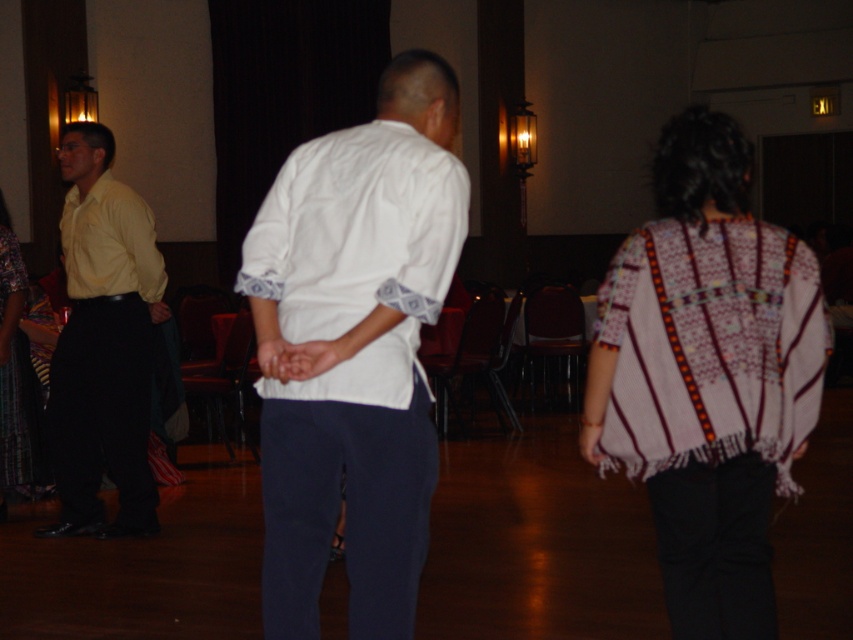
Question: Which object is the farthest from the white cotton dress shirt at center?

Choices:
 (A) patterned fabric poncho at center
 (B) white cotton shirt at center

Answer: (A)

Question: Is white cotton dress shirt at center closer to the viewer compared to yellow matte shirt at left?

Choices:
 (A) yes
 (B) no

Answer: (A)

Question: Does yellow matte shirt at left appear on the right side of patterned fabric poncho at center?

Choices:
 (A) no
 (B) yes

Answer: (B)

Question: Which of the following is the farthest from the observer?

Choices:
 (A) yellow matte shirt at left
 (B) matte yellow shirt at left
 (C) white cotton shirt at center
 (D) knitted wool poncho at center

Answer: (B)

Question: Does knitted wool poncho at center lie behind matte yellow shirt at left?

Choices:
 (A) yes
 (B) no

Answer: (B)

Question: Which of these objects is positioned closest to the matte yellow shirt at left?

Choices:
 (A) yellow matte shirt at left
 (B) white cotton dress shirt at center
 (C) patterned fabric poncho at center

Answer: (A)